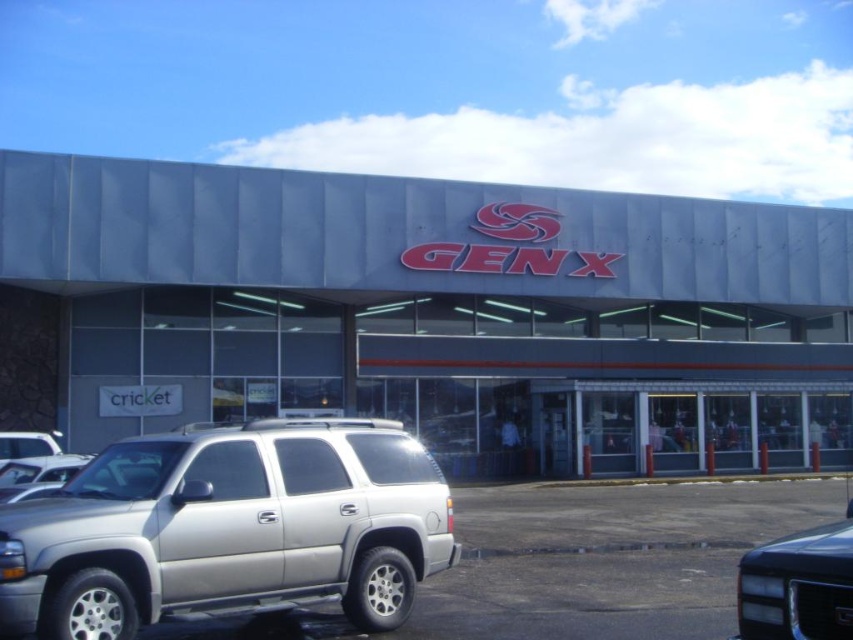
Is point (317, 358) more distant than point (171, 456)?

That is True.

Can you confirm if gray metallic storefront at center is bigger than silver metallic minivan at lower left?

Yes, gray metallic storefront at center is bigger than silver metallic minivan at lower left.

Who is more distant from viewer, (577, 196) or (364, 433)?

Positioned behind is point (577, 196).

At what (x,y) coordinates should I click in order to perform the action: click on gray metallic storefront at center. Please return your answer as a coordinate pair (x, y). The height and width of the screenshot is (640, 853). Looking at the image, I should click on (432, 312).

Is point (18, 596) farther from viewer compared to point (802, 547)?

Yes, point (18, 596) is behind point (802, 547).

Does silver metallic minivan at lower left come behind shiny black suv at lower right?

Yes, silver metallic minivan at lower left is behind shiny black suv at lower right.

What do you see at coordinates (228, 529) in the screenshot?
I see `silver metallic minivan at lower left` at bounding box center [228, 529].

The width and height of the screenshot is (853, 640). I want to click on silver metallic minivan at lower left, so click(x=228, y=529).

Who is taller, gray metallic storefront at center or shiny black suv at lower right?

gray metallic storefront at center is taller.

Can you confirm if gray metallic storefront at center is wider than shiny black suv at lower right?

Correct, the width of gray metallic storefront at center exceeds that of shiny black suv at lower right.

Who is more distant from viewer, (764, 268) or (772, 550)?

The point (764, 268) is behind.

Find the location of a particular element. The image size is (853, 640). gray metallic storefront at center is located at coordinates (432, 312).